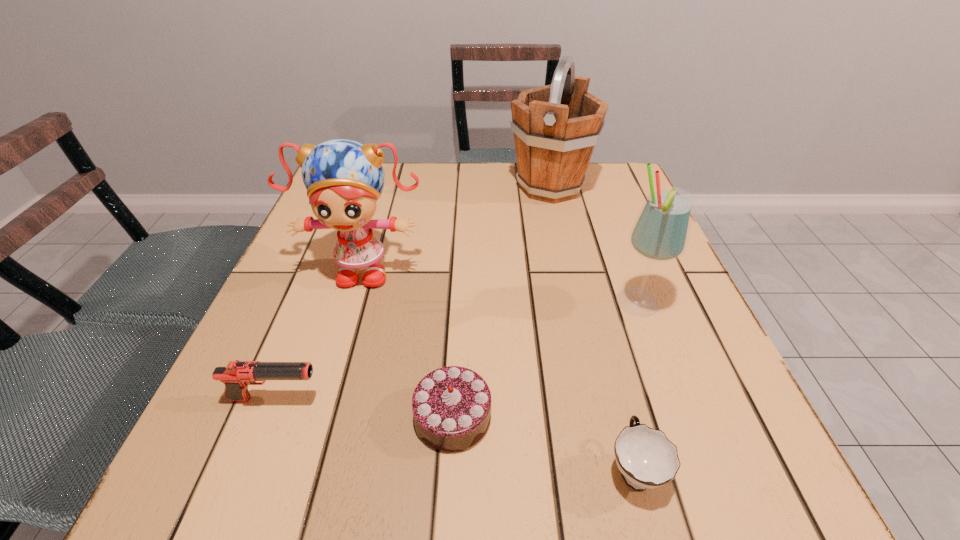
Locate an element on the screen. Image resolution: width=960 pixels, height=540 pixels. object that stands as the fifth closest to the cup is located at coordinates (556, 127).

Find the location of a particular element. The image size is (960, 540). free spot that satisfies the following two spatial constraints: 1. on the face of the alcohol; 2. on the right side of the doll is located at coordinates (352, 304).

Where is `free location that satisfies the following two spatial constraints: 1. on the front side of the alcohol; 2. at the aiming end of the third shortest object`? free location that satisfies the following two spatial constraints: 1. on the front side of the alcohol; 2. at the aiming end of the third shortest object is located at coordinates (672, 399).

Where is `free space that satisfies the following two spatial constraints: 1. on the face of the doll; 2. at the aiming end of the gun`? This screenshot has width=960, height=540. free space that satisfies the following two spatial constraints: 1. on the face of the doll; 2. at the aiming end of the gun is located at coordinates (324, 399).

This screenshot has width=960, height=540. Find the location of `blank area in the image that satisfies the following two spatial constraints: 1. on the face of the doll; 2. on the right side of the third object from left to right`. blank area in the image that satisfies the following two spatial constraints: 1. on the face of the doll; 2. on the right side of the third object from left to right is located at coordinates (319, 416).

At what (x,y) coordinates should I click in order to perform the action: click on free location that satisfies the following two spatial constraints: 1. on the side of the cup with the handle; 2. at the aiming end of the third shortest object. Please return your answer as a coordinate pair (x, y). The width and height of the screenshot is (960, 540). Looking at the image, I should click on pyautogui.click(x=615, y=399).